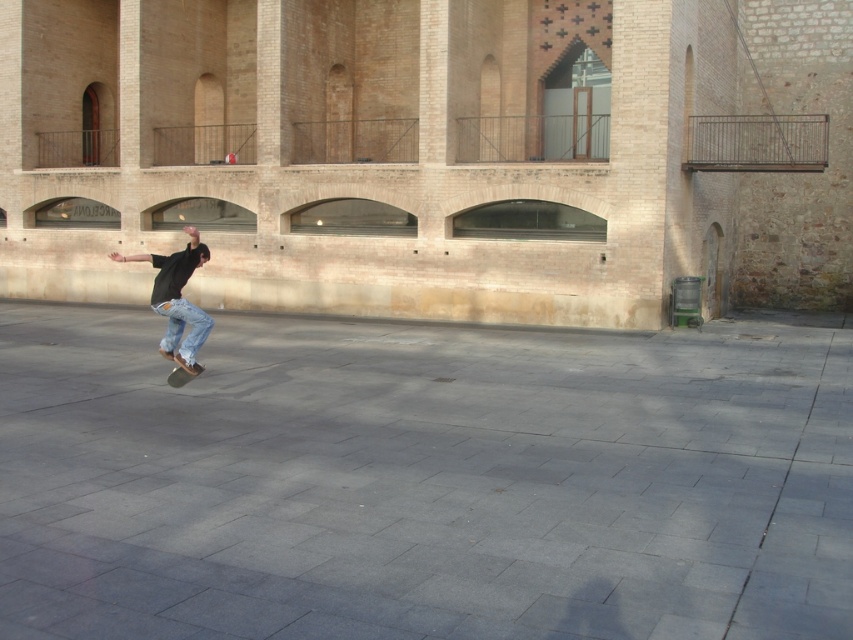
Question: Does denim jeans at center come behind black smooth skateboard at center?

Choices:
 (A) yes
 (B) no

Answer: (B)

Question: Is gray concrete pavement at center below denim jeans at center?

Choices:
 (A) yes
 (B) no

Answer: (A)

Question: Which is nearer to the gray concrete pavement at center?

Choices:
 (A) denim jeans at center
 (B) black smooth skateboard at center

Answer: (B)

Question: Does gray concrete pavement at center appear on the right side of black smooth skateboard at center?

Choices:
 (A) yes
 (B) no

Answer: (A)

Question: Based on their relative distances, which object is farther from the denim jeans at center?

Choices:
 (A) gray concrete pavement at center
 (B) black smooth skateboard at center

Answer: (A)

Question: Which object is farther from the camera taking this photo?

Choices:
 (A) denim jeans at center
 (B) black smooth skateboard at center
 (C) gray concrete pavement at center

Answer: (B)